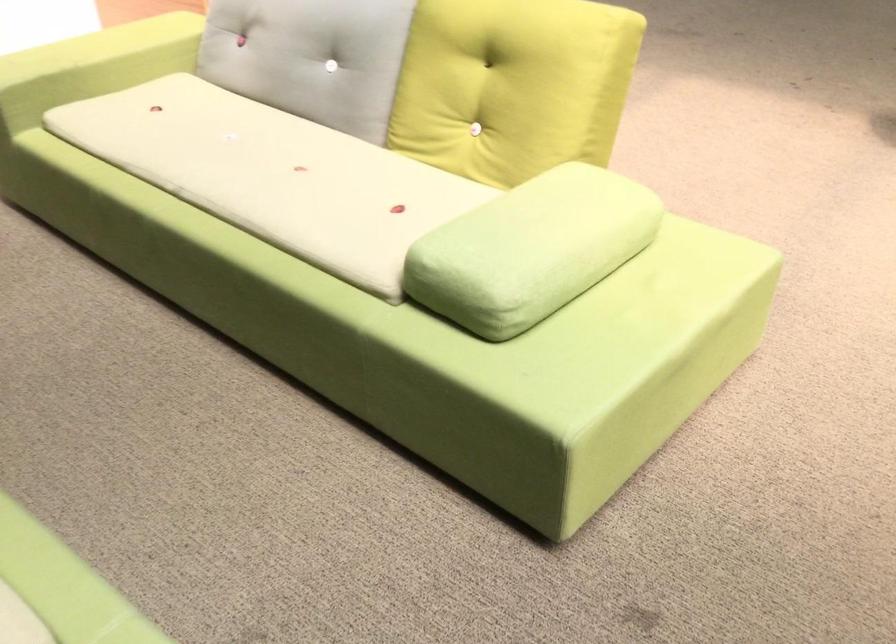
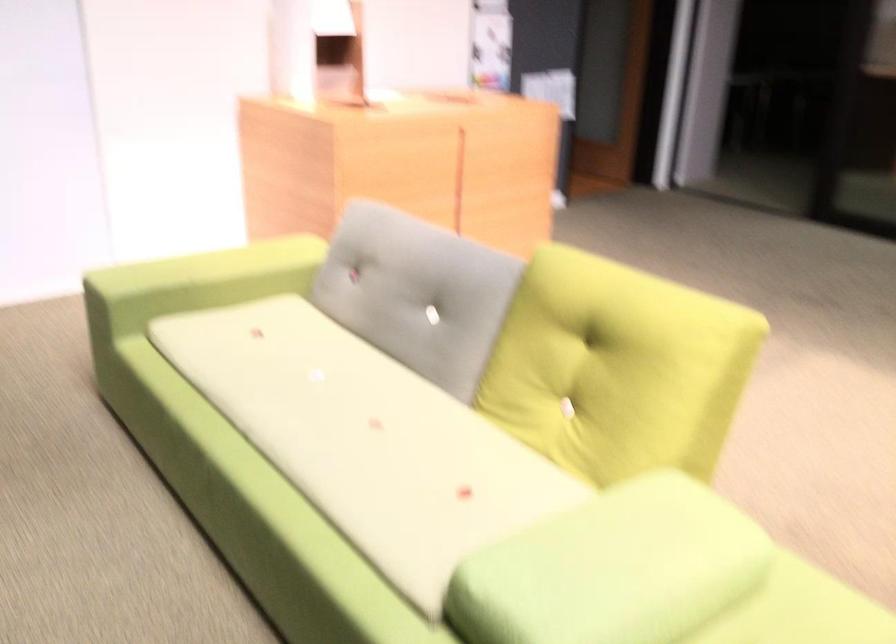
The point at (513, 76) is marked in the first image. Where is the corresponding point in the second image?

(616, 368)